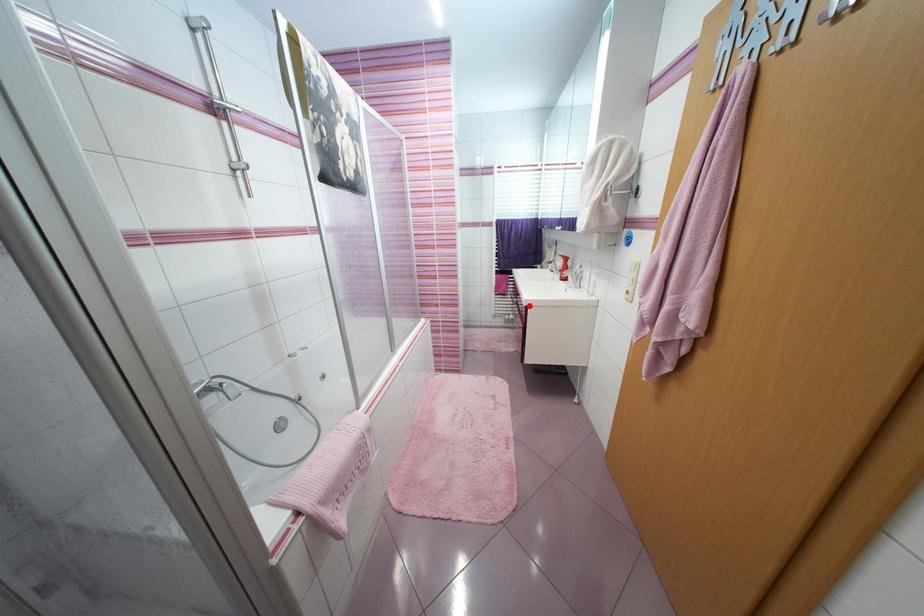
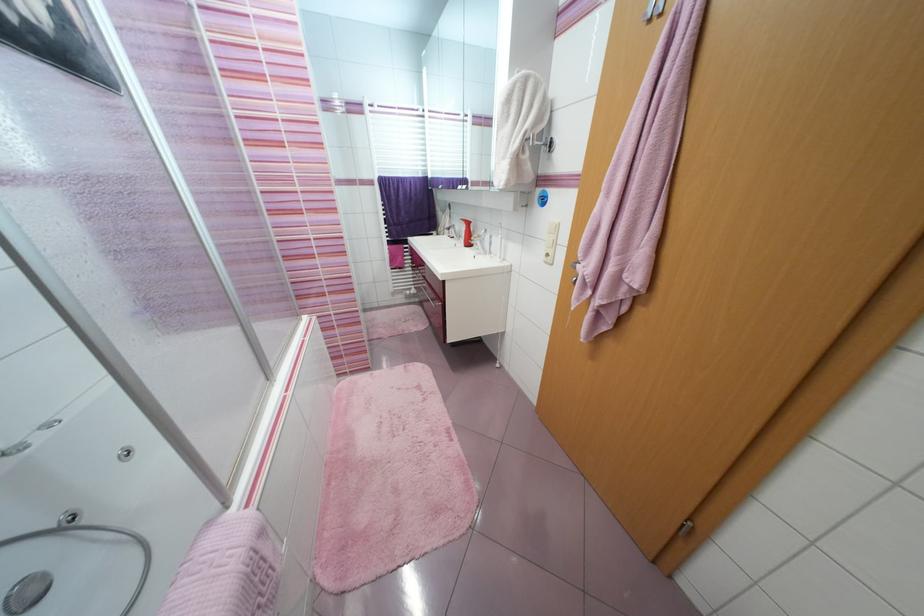
Question: I am providing you with two images of the same scene from different viewpoints. A red point is shown in image1. For the corresponding object point in image2, is it positioned nearer or farther from the camera?

Choices:
 (A) Nearer
 (B) Farther

Answer: (B)